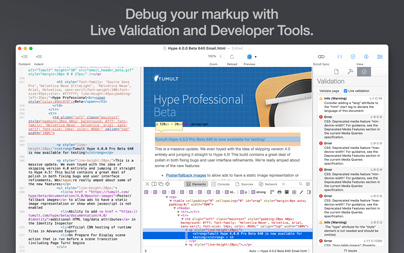
Identify the location of notepad of some sort. 273,86, 284,101, 286,113.